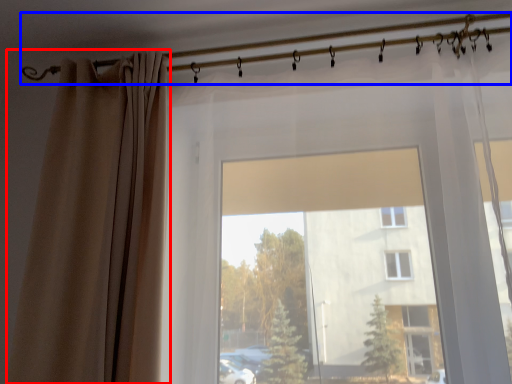
Question: Which point is closer to the camera, curtain (highlighted by a red box) or clothesline (highlighted by a blue box)?

Choices:
 (A) curtain
 (B) clothesline

Answer: (A)